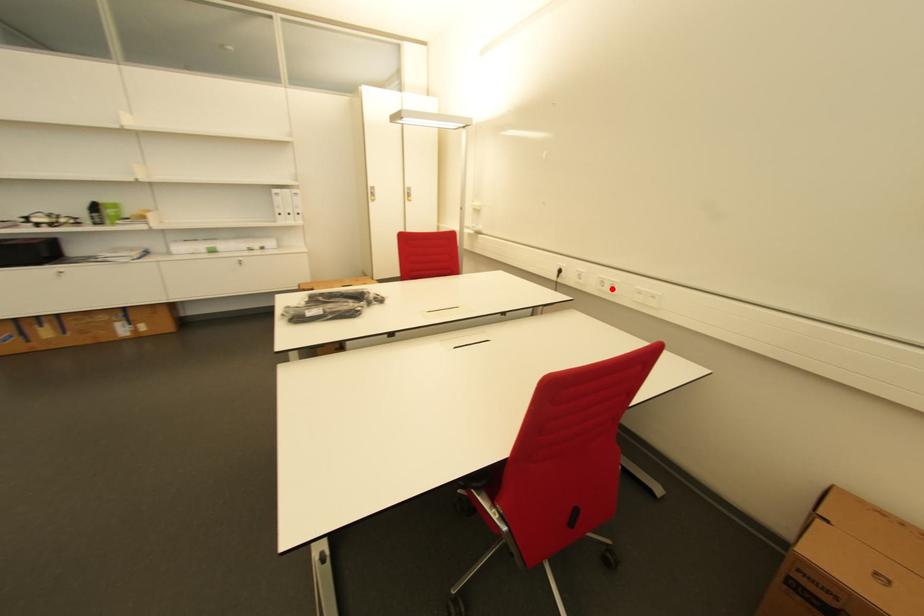
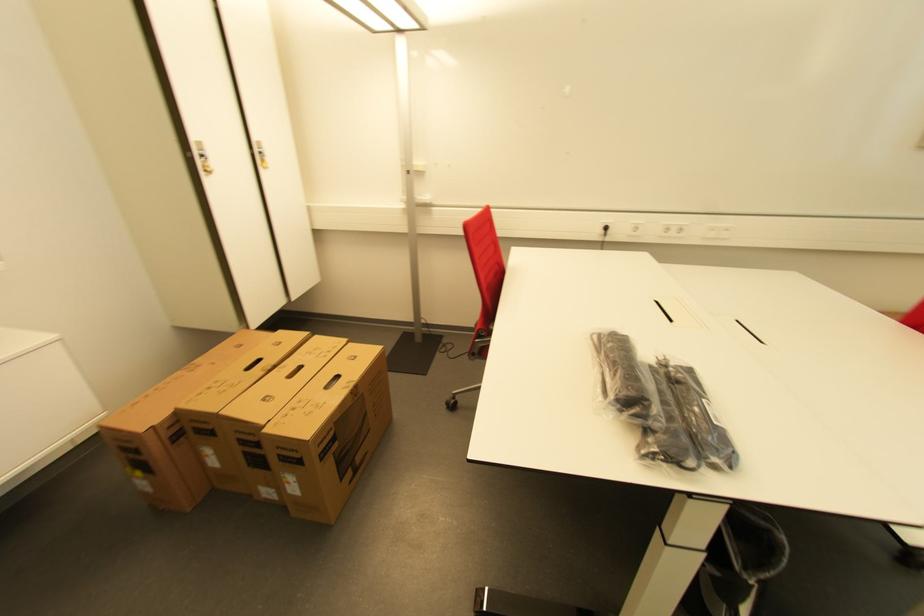
The point at the highlighted location is marked in the first image. Where is the corresponding point in the second image?

(676, 233)